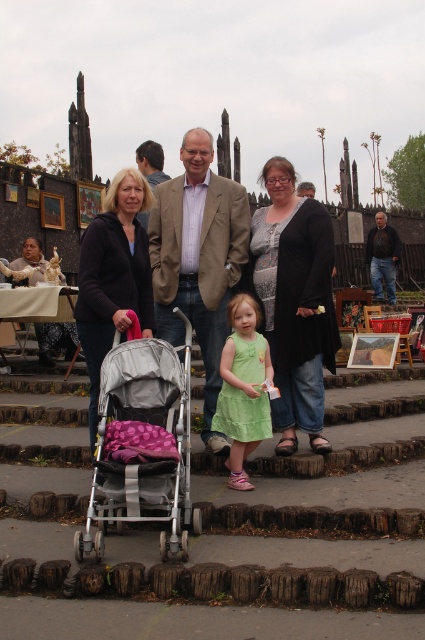
Can you confirm if silver metallic stroller at center is bigger than green cotton dress at center?

Indeed, silver metallic stroller at center has a larger size compared to green cotton dress at center.

Can you confirm if silver metallic stroller at center is positioned to the right of green cotton dress at center?

In fact, silver metallic stroller at center is to the left of green cotton dress at center.

This screenshot has height=640, width=425. What do you see at coordinates (144, 444) in the screenshot? I see `silver metallic stroller at center` at bounding box center [144, 444].

At what (x,y) coordinates should I click in order to perform the action: click on silver metallic stroller at center. Please return your answer as a coordinate pair (x, y). This screenshot has height=640, width=425. Looking at the image, I should click on [x=144, y=444].

Does green cotton dress at center appear on the right side of brown leather jacket at center?

In fact, green cotton dress at center is to the left of brown leather jacket at center.

Is green cotton dress at center thinner than brown leather jacket at center?

Correct, green cotton dress at center's width is less than brown leather jacket at center's.

In order to click on green cotton dress at center in this screenshot , I will do `click(243, 387)`.

Is point (155, 346) less distant than point (130, 288)?

That is True.

Does silver metallic stroller at center have a larger size compared to matte black jacket at left?

No, silver metallic stroller at center is not bigger than matte black jacket at left.

The height and width of the screenshot is (640, 425). What do you see at coordinates (144, 444) in the screenshot? I see `silver metallic stroller at center` at bounding box center [144, 444].

Locate an element on the screen. The width and height of the screenshot is (425, 640). silver metallic stroller at center is located at coordinates (144, 444).